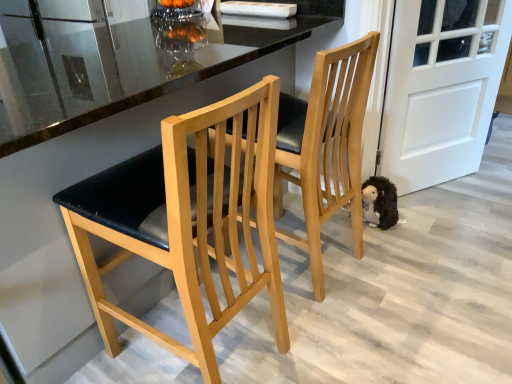
In order to face fuzzy brown plush at lower right, should I rotate leftwards or rightwards?

Rotate right and turn 17.258 degrees.

At what (x,y) coordinates should I click in order to perform the action: click on matte wood chair at center, which is counted as the 1th chair, starting from the right. Please return your answer as a coordinate pair (x, y). The image size is (512, 384). Looking at the image, I should click on (326, 146).

Based on the photo, what is the approximate height of matte wood chair at center, placed as the second chair when sorted from left to right?

It is 36.36 inches.

Where is `fuzzy brown plush at lower right`? This screenshot has width=512, height=384. fuzzy brown plush at lower right is located at coordinates (379, 202).

Is matte wood chair at center, placed as the second chair when sorted from left to right, thinner than white matte door at right?

Incorrect, the width of matte wood chair at center, placed as the second chair when sorted from left to right, is not less than that of white matte door at right.

From a real-world perspective, is matte wood chair at center, placed as the second chair when sorted from left to right, physically above white matte door at right?

No, from a real-world perspective, matte wood chair at center, placed as the second chair when sorted from left to right, is not on top of white matte door at right.

Is matte wood chair at center, placed as the second chair when sorted from left to right, located outside white matte door at right?

Indeed, matte wood chair at center, placed as the second chair when sorted from left to right, is completely outside white matte door at right.

How different are the orientations of matte wood chair at center, placed as the second chair when sorted from left to right, and white matte door at right in degrees?

The angle between the facing direction of matte wood chair at center, placed as the second chair when sorted from left to right, and the facing direction of white matte door at right is 152 degrees.

Is matte wood chair at center, which is counted as the 1th chair, starting from the right, oriented away from matte black seat at center, acting as the second chair starting from the right?

matte wood chair at center, which is counted as the 1th chair, starting from the right, does not have its back to matte black seat at center, acting as the second chair starting from the right.

In terms of size, does matte wood chair at center, placed as the second chair when sorted from left to right, appear bigger or smaller than matte black seat at center, acting as the second chair starting from the right?

Considering their sizes, matte wood chair at center, placed as the second chair when sorted from left to right, takes up more space than matte black seat at center, acting as the second chair starting from the right.

Is matte wood chair at center, placed as the second chair when sorted from left to right, situated inside matte black seat at center, acting as the second chair starting from the right, or outside?

matte wood chair at center, placed as the second chair when sorted from left to right, is spatially situated outside matte black seat at center, acting as the second chair starting from the right.

Who is shorter, matte wood chair at center, placed as the second chair when sorted from left to right, or matte black seat at center, acting as the first chair starting from the left?

Standing shorter between the two is matte wood chair at center, placed as the second chair when sorted from left to right.

Is white matte door at right at the back of fuzzy brown plush at lower right?

No, fuzzy brown plush at lower right's orientation is not away from white matte door at right.

Between fuzzy brown plush at lower right and white matte door at right, which one has less height?

Standing shorter between the two is fuzzy brown plush at lower right.

Would you say fuzzy brown plush at lower right contains white matte door at right?

No, white matte door at right is not a part of fuzzy brown plush at lower right.

From the image's perspective, is fuzzy brown plush at lower right on white matte door at right?

No, from the image's perspective, fuzzy brown plush at lower right is not above white matte door at right.

Considering the relative positions of white matte door at right and matte wood chair at center, placed as the second chair when sorted from left to right, in the image provided, is white matte door at right to the left of matte wood chair at center, placed as the second chair when sorted from left to right, from the viewer's perspective?

No.

In the scene shown: Between white matte door at right and matte wood chair at center, which is counted as the 1th chair, starting from the right, which one has smaller width?

white matte door at right.

From a real-world perspective, is white matte door at right physically above matte wood chair at center, which is counted as the 1th chair, starting from the right?

Indeed, from a real-world perspective, white matte door at right stands above matte wood chair at center, which is counted as the 1th chair, starting from the right.

Which object is further away from the camera, white matte door at right or matte wood chair at center, which is counted as the 1th chair, starting from the right?

Positioned behind is white matte door at right.

Based on the photo, would you say fuzzy brown plush at lower right is to the left or to the right of matte black seat at center, acting as the second chair starting from the right, in the picture?

Clearly, fuzzy brown plush at lower right is on the right of matte black seat at center, acting as the second chair starting from the right, in the image.

Could you tell me if fuzzy brown plush at lower right is facing matte black seat at center, acting as the second chair starting from the right?

No, fuzzy brown plush at lower right is not turned towards matte black seat at center, acting as the second chair starting from the right.

From a real-world perspective, is fuzzy brown plush at lower right on matte black seat at center, acting as the first chair starting from the left?

No, from a real-world perspective, fuzzy brown plush at lower right is not above matte black seat at center, acting as the first chair starting from the left.

Is white matte door at right located outside fuzzy brown plush at lower right?

Yes, white matte door at right is outside of fuzzy brown plush at lower right.

Which is behind, point (430, 11) or point (362, 218)?

The point (362, 218) is farther from the camera.

At what (x,y) coordinates should I click in order to perform the action: click on animal located underneath the white matte door at right (from a real-world perspective). Please return your answer as a coordinate pair (x, y). The width and height of the screenshot is (512, 384). Looking at the image, I should click on (379, 202).

From the image's perspective, would you say white matte door at right is positioned over fuzzy brown plush at lower right?

Correct, white matte door at right appears higher than fuzzy brown plush at lower right in the image.

Is matte black seat at center, acting as the second chair starting from the right, to the right of matte wood chair at center, which is counted as the 1th chair, starting from the right, from the viewer's perspective?

No.

Is matte black seat at center, acting as the second chair starting from the right, positioned with its back to matte wood chair at center, which is counted as the 1th chair, starting from the right?

No, matte black seat at center, acting as the second chair starting from the right,'s orientation is not away from matte wood chair at center, which is counted as the 1th chair, starting from the right.

Considering the relative sizes of matte black seat at center, acting as the second chair starting from the right, and matte wood chair at center, which is counted as the 1th chair, starting from the right, in the image provided, is matte black seat at center, acting as the second chair starting from the right, wider than matte wood chair at center, which is counted as the 1th chair, starting from the right,?

Incorrect, the width of matte black seat at center, acting as the second chair starting from the right, does not surpass that of matte wood chair at center, which is counted as the 1th chair, starting from the right.

Based on the photo, from a real-world perspective, which is physically below, matte black seat at center, acting as the second chair starting from the right, or matte wood chair at center, placed as the second chair when sorted from left to right?

matte black seat at center, acting as the second chair starting from the right.

Where is `door that appears above the matte wood chair at center, which is counted as the 1th chair, starting from the right (from a real-world perspective)`? The height and width of the screenshot is (384, 512). door that appears above the matte wood chair at center, which is counted as the 1th chair, starting from the right (from a real-world perspective) is located at coordinates (441, 88).

You are a GUI agent. You are given a task and a screenshot of the screen. Output one action in this format:
    pyautogui.click(x=<x>, y=<y>)
    Task: Click on the chair on the right of matte black seat at center, acting as the second chair starting from the right
    The image size is (512, 384).
    Given the screenshot: What is the action you would take?
    [x=326, y=146]

From the image, which object appears to be farther from matte black seat at center, acting as the second chair starting from the right, matte wood chair at center, which is counted as the 1th chair, starting from the right, or fuzzy brown plush at lower right?

Based on the image, fuzzy brown plush at lower right appears to be further to matte black seat at center, acting as the second chair starting from the right.

Based on their spatial positions, is white matte door at right or fuzzy brown plush at lower right closer to matte wood chair at center, placed as the second chair when sorted from left to right?

fuzzy brown plush at lower right is positioned closer to the anchor matte wood chair at center, placed as the second chair when sorted from left to right.

Looking at this image, which object lies further to the anchor point white matte door at right, fuzzy brown plush at lower right or matte wood chair at center, which is counted as the 1th chair, starting from the right?

matte wood chair at center, which is counted as the 1th chair, starting from the right, is positioned further to the anchor white matte door at right.

From the image, which object appears to be farther from white matte door at right, matte wood chair at center, placed as the second chair when sorted from left to right, or fuzzy brown plush at lower right?

matte wood chair at center, placed as the second chair when sorted from left to right.

Estimate the real-world distances between objects in this image. Which object is further from fuzzy brown plush at lower right, matte wood chair at center, which is counted as the 1th chair, starting from the right, or matte black seat at center, acting as the second chair starting from the right?

matte black seat at center, acting as the second chair starting from the right, lies further to fuzzy brown plush at lower right than the other object.

When comparing their distances from fuzzy brown plush at lower right, does white matte door at right or matte wood chair at center, placed as the second chair when sorted from left to right, seem closer?

The object closer to fuzzy brown plush at lower right is matte wood chair at center, placed as the second chair when sorted from left to right.

Looking at the image, which one is located further to matte wood chair at center, which is counted as the 1th chair, starting from the right, fuzzy brown plush at lower right or white matte door at right?

white matte door at right lies further to matte wood chair at center, which is counted as the 1th chair, starting from the right, than the other object.

When comparing their distances from fuzzy brown plush at lower right, does matte black seat at center, acting as the first chair starting from the left, or matte wood chair at center, which is counted as the 1th chair, starting from the right, seem further?

matte black seat at center, acting as the first chair starting from the left, is positioned further to the anchor fuzzy brown plush at lower right.

Where is `animal between matte wood chair at center, which is counted as the 1th chair, starting from the right, and white matte door at right, in the horizontal direction`? animal between matte wood chair at center, which is counted as the 1th chair, starting from the right, and white matte door at right, in the horizontal direction is located at coordinates (379, 202).

At what (x,y) coordinates should I click in order to perform the action: click on chair located between matte black seat at center, acting as the second chair starting from the right, and fuzzy brown plush at lower right in the depth direction. Please return your answer as a coordinate pair (x, y). Looking at the image, I should click on [326, 146].

I want to click on chair between matte black seat at center, acting as the first chair starting from the left, and white matte door at right, in the horizontal direction, so pos(326,146).

I want to click on door between matte black seat at center, acting as the first chair starting from the left, and fuzzy brown plush at lower right, along the z-axis, so click(x=441, y=88).